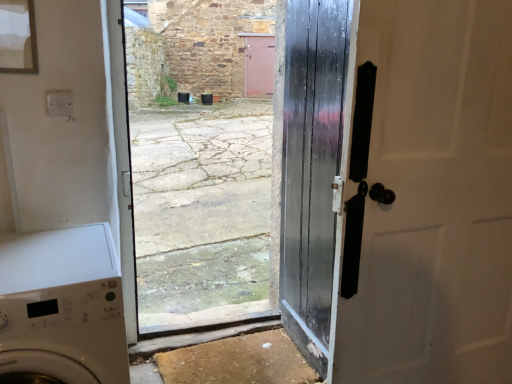
Question: Is matte black door at right, the first door when ordered from right to left, wider or thinner than glossy black door at center, placed as the 2th door when sorted from right to left?

Choices:
 (A) thin
 (B) wide

Answer: (B)

Question: Is matte black door at right, the first door when ordered from right to left, taller or shorter than glossy black door at center, placed as the 2th door when sorted from right to left?

Choices:
 (A) tall
 (B) short

Answer: (B)

Question: Based on their relative distances, which object is farther from the white glossy washing machine at lower left?

Choices:
 (A) glossy black door at center, placed as the 2th door when sorted from right to left
 (B) matte black door at right, the first door when ordered from right to left

Answer: (B)

Question: Which object is positioned closest to the glossy black door at center, the first door when ordered from left to right?

Choices:
 (A) white glossy washing machine at lower left
 (B) matte black door at right, positioned as the second door in left-to-right order

Answer: (B)